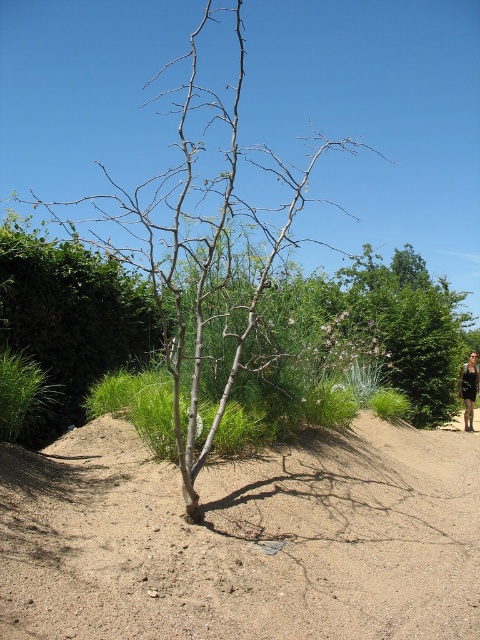
Who is more distant from viewer, [312,141] or [464,401]?

Positioned behind is point [312,141].

Is point (181, 113) closer to camera compared to point (472, 416)?

No, (181, 113) is further to viewer.

Does point (201, 305) lie behind point (459, 384)?

No, (201, 305) is closer to viewer.

This screenshot has height=640, width=480. I want to click on bare wood tree at center, so click(195, 240).

Is point (199, 552) in front of point (171, 378)?

Yes, it is in front of point (171, 378).

Can you confirm if brown sandy soil at center is smaller than bare wood tree at center?

Yes, brown sandy soil at center is smaller than bare wood tree at center.

Describe the element at coordinates (243, 538) in the screenshot. This screenshot has width=480, height=640. I see `brown sandy soil at center` at that location.

Identify the location of brown sandy soil at center. (243, 538).

Measure the distance from brown sandy soil at center to black leather dress at lower right.

They are 7.55 meters apart.

Is point (24, 576) less distant than point (468, 429)?

Yes, point (24, 576) is closer to viewer.

Locate an element on the screen. The height and width of the screenshot is (640, 480). brown sandy soil at center is located at coordinates (243, 538).